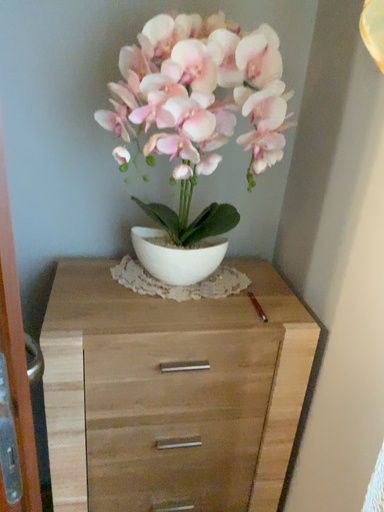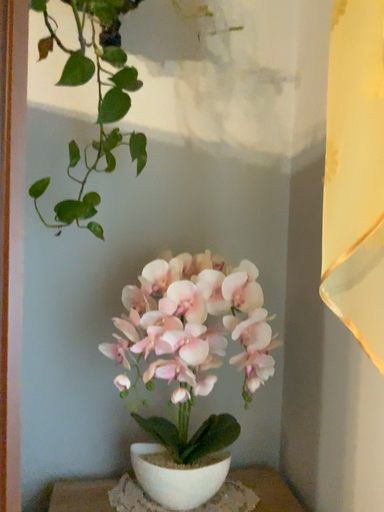
Question: How did the camera likely rotate when shooting the video?

Choices:
 (A) rotated downward
 (B) rotated upward

Answer: (B)